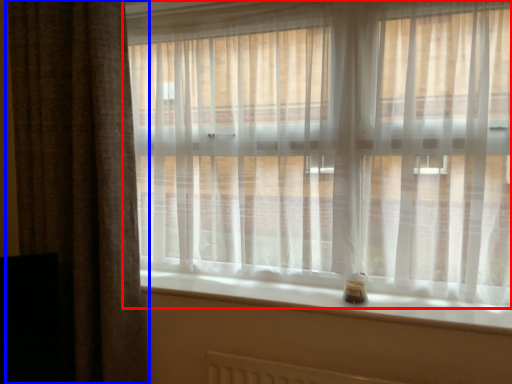
Question: Among these objects, which one is farthest to the camera, curtain (highlighted by a red box) or curtain (highlighted by a blue box)?

Choices:
 (A) curtain
 (B) curtain

Answer: (B)